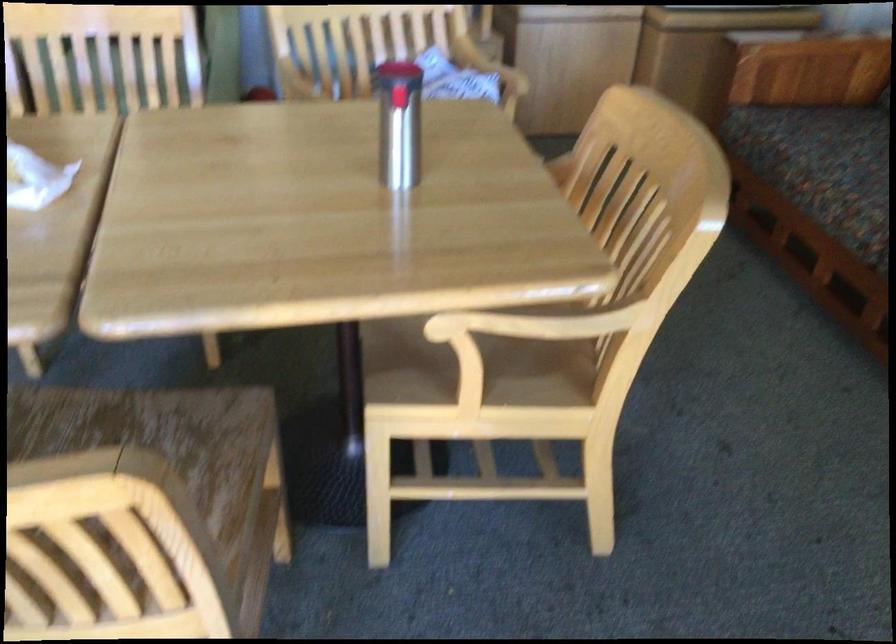
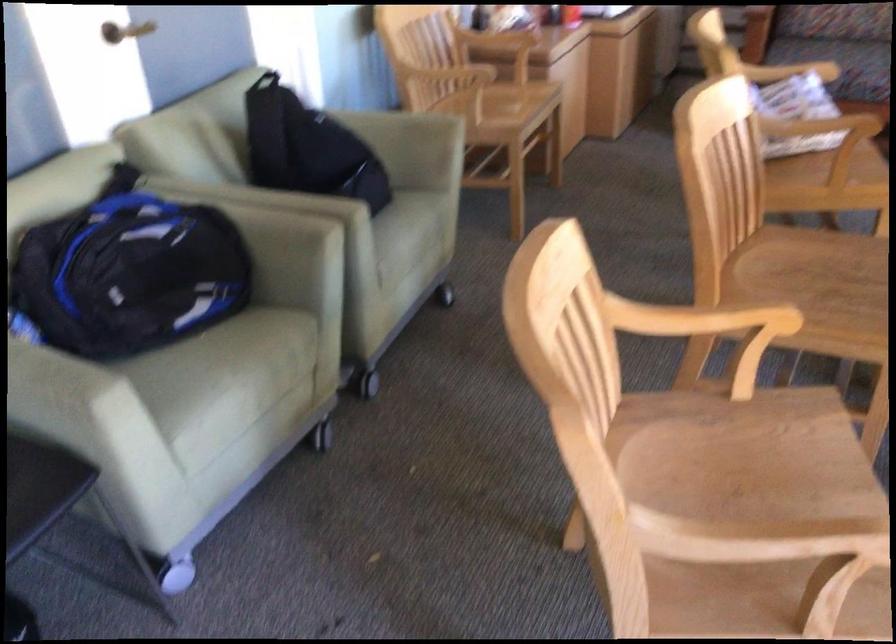
Locate, in the second image, the point that corresponds to [435,89] in the first image.

(790, 71)